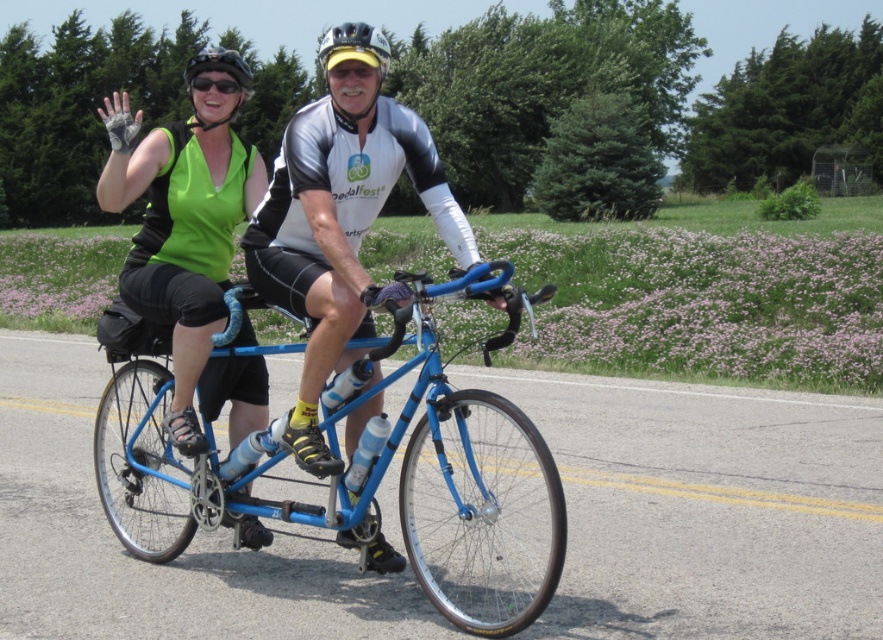
You are standing on the side of the road watching the cyclists. If you want to throw a water bottle to the front cyclist, who is wearing a white and black cycling jersey, and the back cyclist, who is wearing a green sleeveless top, which cyclist is closer to you? The point where you are standing is at coordinates point (232, 52) which is 5.28 meters away from you.

The point (232, 52) is 5.28 meters from the viewer. Since both cyclists are on the tandem bicycle, their distance from you would be the same as the bicycle itself. Therefore, both cyclists are equally close to you at 5.28 meters.

You are a photographer trying to capture the cyclist in the green matte tank top at left. According to the coordinates provided, where should you aim your camera to ensure the cyclist is centered in your shot?

The green matte tank top at left is located at coordinates point (189,243), so you should aim your camera at that point to center the cyclist in your shot.